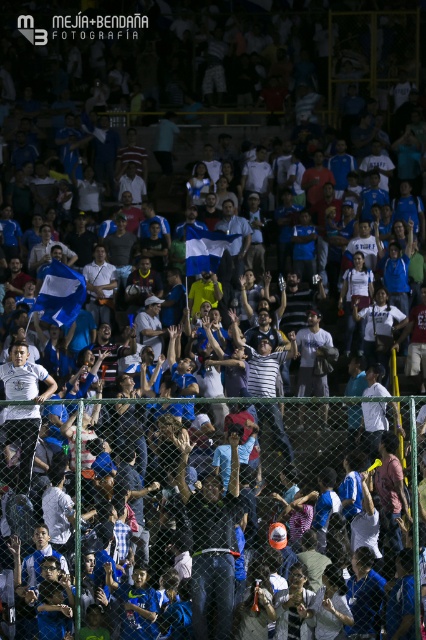
Question: Is blue fabric flag at center further to the viewer compared to white fabric flag at center?

Choices:
 (A) yes
 (B) no

Answer: (B)

Question: Is blue fabric flag at center bigger than white fabric flag at center?

Choices:
 (A) no
 (B) yes

Answer: (B)

Question: Which point is farther from the camera taking this photo?

Choices:
 (A) (201, 237)
 (B) (62, 280)

Answer: (A)

Question: Is dark gray fabric jacket at center below white fabric flag at center?

Choices:
 (A) yes
 (B) no

Answer: (A)

Question: Which object appears farthest from the camera in this image?

Choices:
 (A) white fabric flag at center
 (B) blue fabric flag at center
 (C) dark gray fabric jacket at center

Answer: (A)

Question: Which point is closer to the camera?

Choices:
 (A) dark gray fabric jacket at center
 (B) blue fabric flag at center

Answer: (A)